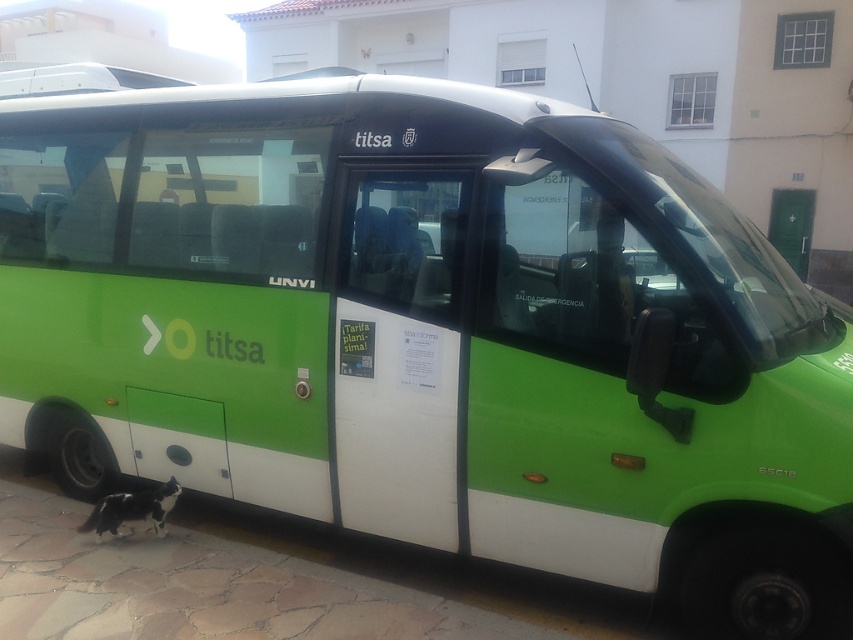
Question: Which of the following is the closest to the observer?

Choices:
 (A) black rubber curb at lower left
 (B) black and white fur cat at lower left

Answer: (A)

Question: Where is black rubber curb at lower left located in relation to black and white fur cat at lower left in the image?

Choices:
 (A) below
 (B) above

Answer: (A)

Question: Which point is farther to the camera?

Choices:
 (A) black and white fur cat at lower left
 (B) black rubber curb at lower left

Answer: (A)

Question: Is black rubber curb at lower left positioned at the back of black and white fur cat at lower left?

Choices:
 (A) yes
 (B) no

Answer: (B)

Question: Which object is closer to the camera taking this photo?

Choices:
 (A) black and white fur cat at lower left
 (B) black rubber curb at lower left

Answer: (B)

Question: Is black rubber curb at lower left further to camera compared to black and white fur cat at lower left?

Choices:
 (A) no
 (B) yes

Answer: (A)